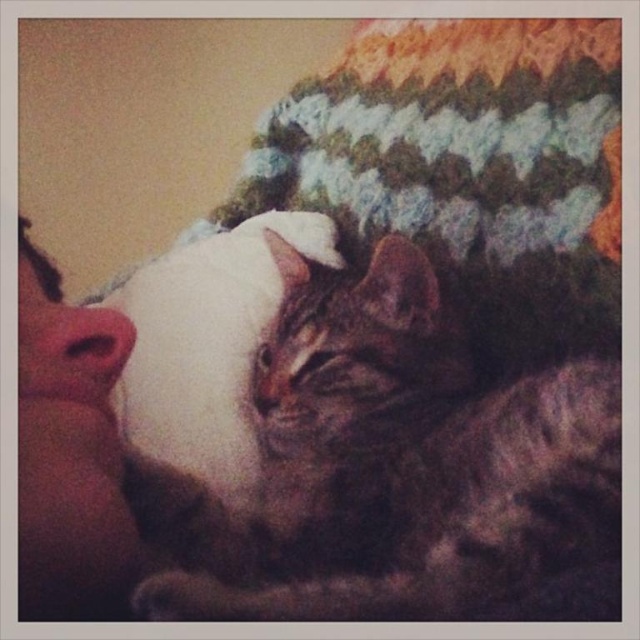
Question: Is tabby fur cat at center below white fluffy pillow at center?

Choices:
 (A) yes
 (B) no

Answer: (A)

Question: Is tabby fur cat at center below white fluffy pillow at center?

Choices:
 (A) yes
 (B) no

Answer: (A)

Question: Is tabby fur cat at center thinner than white fluffy pillow at center?

Choices:
 (A) no
 (B) yes

Answer: (A)